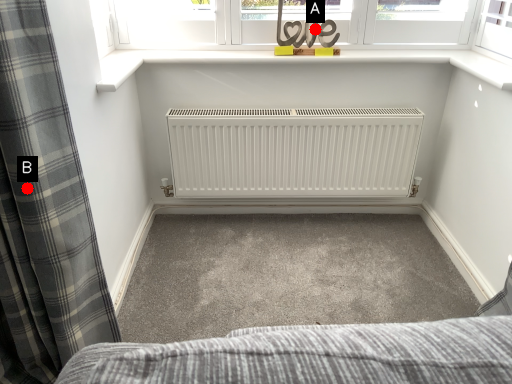
Question: Two points are circled on the image, labeled by A and B beside each circle. Which point appears farthest from the camera in this image?

Choices:
 (A) A is further
 (B) B is further

Answer: (A)